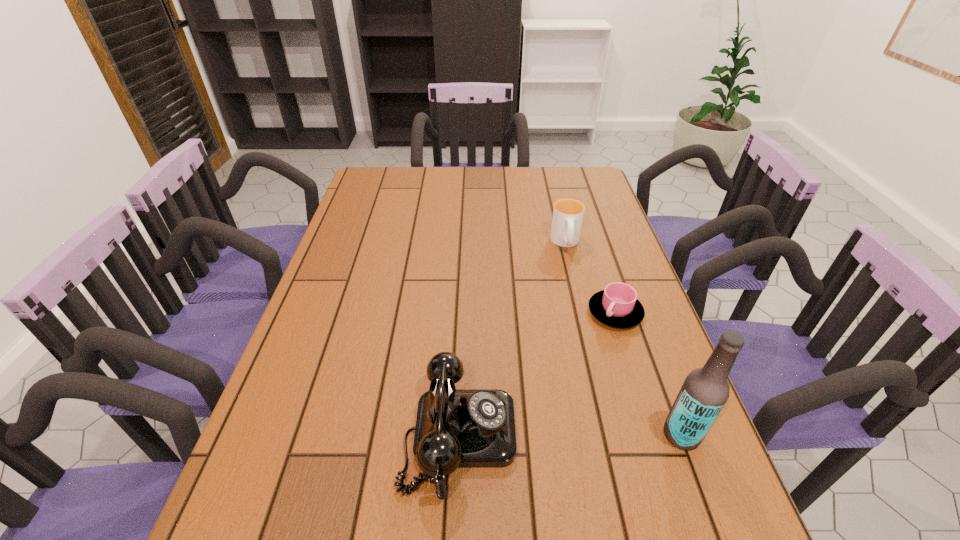
What are the coordinates of `empty space between the shortest object and the taller cup` in the screenshot? It's located at (590, 278).

Image resolution: width=960 pixels, height=540 pixels. I want to click on free spot between the farther cup and the beer bottle, so click(x=624, y=339).

Identify the location of vacant area that lies between the leftmost object and the farther cup. Image resolution: width=960 pixels, height=540 pixels. (513, 339).

Locate which object ranks in proximity to the tallest object. Please provide its 2D coordinates. Your answer should be formatted as a tuple, i.e. [(x, y)], where the tuple contains the x and y coordinates of a point satisfying the conditions above.

[(617, 306)]

Locate which object is the second closest to the shortest object. Please provide its 2D coordinates. Your answer should be formatted as a tuple, i.e. [(x, y)], where the tuple contains the x and y coordinates of a point satisfying the conditions above.

[(705, 391)]

Find the location of a particular element. The image size is (960, 540). vacant space that satisfies the following two spatial constraints: 1. on the front side of the beer bottle; 2. on the label of the farther cup is located at coordinates (612, 434).

The height and width of the screenshot is (540, 960). In order to click on free space that satisfies the following two spatial constraints: 1. on the front side of the beer bottle; 2. on the label of the farthest object in this screenshot , I will do `click(612, 434)`.